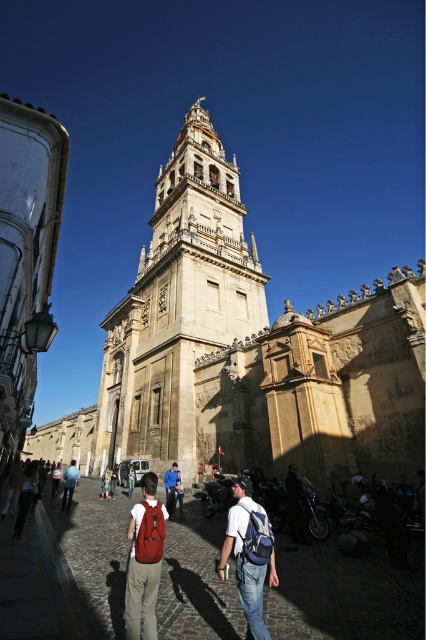
Which is above, brown stone tower at center or light brown leather jacket at center?

brown stone tower at center is above.

Who is shorter, brown stone tower at center or light brown leather jacket at center?

light brown leather jacket at center

Where is `brown stone tower at center`? The width and height of the screenshot is (426, 640). brown stone tower at center is located at coordinates (180, 308).

Is denim backpack at center to the right of denim jacket at lower left from the viewer's perspective?

Indeed, denim backpack at center is positioned on the right side of denim jacket at lower left.

Between denim backpack at center and denim jacket at lower left, which one appears on the left side from the viewer's perspective?

From the viewer's perspective, denim jacket at lower left appears more on the left side.

Does point (244, 586) lie in front of point (71, 490)?

Yes, point (244, 586) is in front of point (71, 490).

At what (x,y) coordinates should I click in order to perform the action: click on denim backpack at center. Please return your answer as a coordinate pair (x, y). Looking at the image, I should click on (247, 560).

Between point (167, 499) and point (132, 484), which one is positioned in front?

Point (167, 499) is more forward.

Identify the location of blue fabric backpack at center. (170, 486).

Is point (180, 497) farther from viewer compared to point (129, 486)?

No, (180, 497) is in front of (129, 486).

You are a GUI agent. You are given a task and a screenshot of the screen. Output one action in this format:
    pyautogui.click(x=<x>, y=<y>)
    Task: Click on the blue fabric backpack at center
    
    Given the screenshot: What is the action you would take?
    pyautogui.click(x=170, y=486)